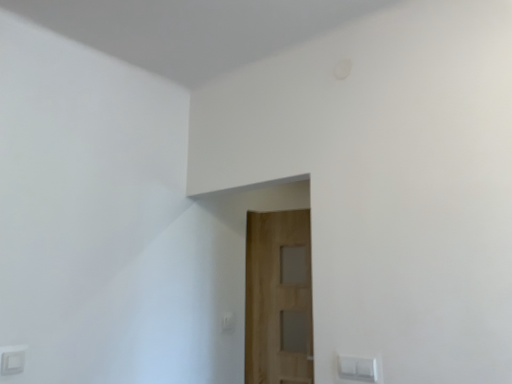
Question: Would you say wooden door at center is to the left or to the right of white plastic light switch at lower center in the picture?

Choices:
 (A) left
 (B) right

Answer: (B)

Question: Is wooden door at center wider or thinner than white plastic light switch at lower center?

Choices:
 (A) thin
 (B) wide

Answer: (B)

Question: From a real-world perspective, is wooden door at center above or below white plastic light switch at lower center?

Choices:
 (A) below
 (B) above

Answer: (B)

Question: Is point (232, 319) positioned closer to the camera than point (280, 374)?

Choices:
 (A) closer
 (B) farther

Answer: (B)

Question: Considering the positions of white plastic light switch at lower center and wooden door at center in the image, is white plastic light switch at lower center taller or shorter than wooden door at center?

Choices:
 (A) short
 (B) tall

Answer: (A)

Question: From a real-world perspective, is white plastic light switch at lower center positioned above or below wooden door at center?

Choices:
 (A) above
 (B) below

Answer: (B)

Question: Considering the positions of white plastic light switch at lower center and wooden door at center in the image, is white plastic light switch at lower center bigger or smaller than wooden door at center?

Choices:
 (A) big
 (B) small

Answer: (B)